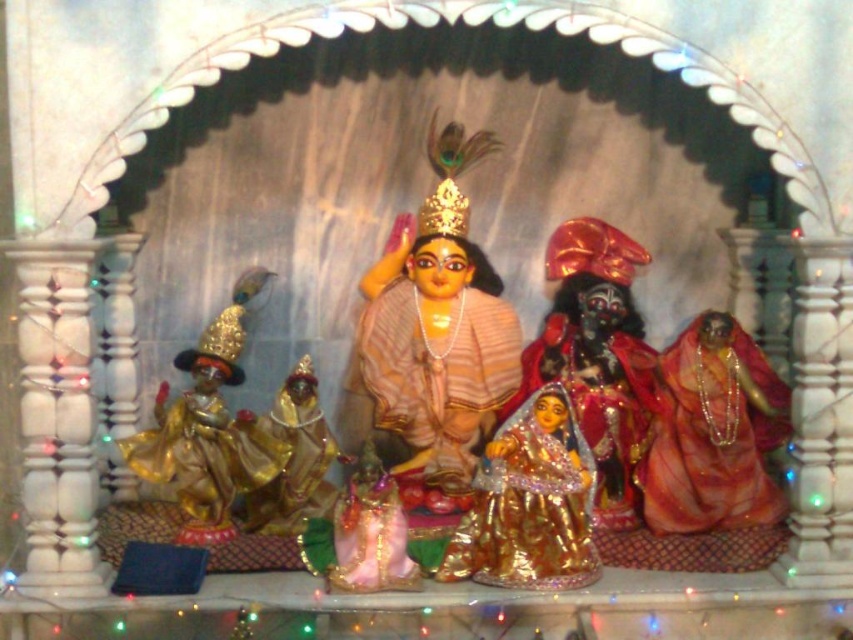
You are standing in front of the Hindu altar and want to place a small offering between the two points marked as point (288, 444) and point (363, 588). Which point is closer to you so you can place the offering there?

Point (288, 444) is closer to you than point (363, 588), so you can place the offering there.

Consider the image. You are standing in front of the Hindu altar and want to place a flower offering. The shiny gold statue at right is blocking your view of the gold shiny statue at center. Which statue should you move to access the one behind?

The shiny gold statue at right is blocking the view of the gold shiny statue at center. To access the one behind, you should move the shiny gold statue at right.

Consider the image. You are organizing a temple display and need to place the matte gold statue at center and the shiny gold statue at right in a row. Which statue should be placed first if you want the larger one to be in the middle of the row?

The matte gold statue at center should be placed first in the middle of the row because it is larger than the shiny gold statue at right.